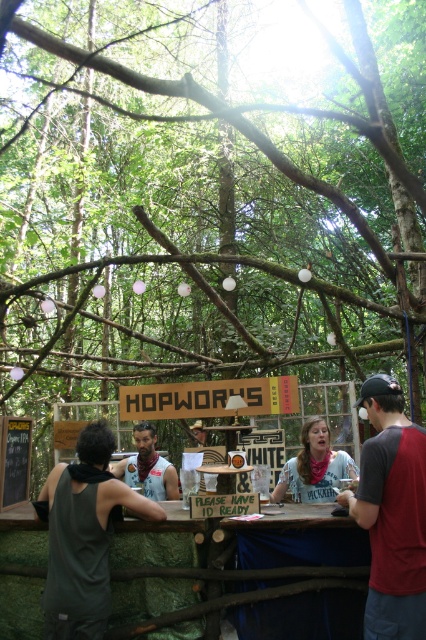
Question: Does white cotton shirt at center come in front of matte gray tank top at center?

Choices:
 (A) yes
 (B) no

Answer: (A)

Question: Which of the following is the farthest from the observer?

Choices:
 (A) (150, 429)
 (B) (340, 454)

Answer: (A)

Question: Does gray/red t-shirt at right have a larger size compared to white cotton shirt at center?

Choices:
 (A) yes
 (B) no

Answer: (A)

Question: Which object appears closest to the camera in this image?

Choices:
 (A) gray/red t-shirt at right
 (B) matte gray tank top at center

Answer: (A)

Question: Which point appears farthest from the camera in this image?

Choices:
 (A) (293, 465)
 (B) (158, 476)
 (C) (419, 547)

Answer: (B)

Question: Where is gray/red t-shirt at right located in relation to matte gray tank top at center in the image?

Choices:
 (A) below
 (B) above

Answer: (B)